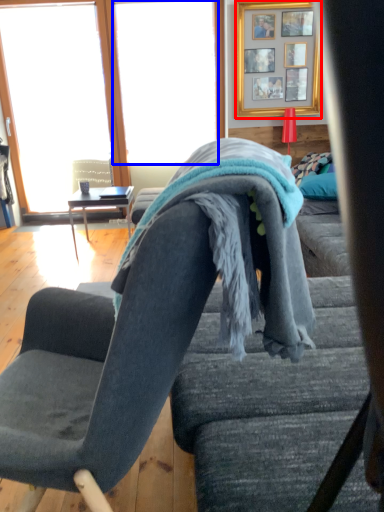
Question: Which point is further to the camera, picture frame (highlighted by a red box) or window screen (highlighted by a blue box)?

Choices:
 (A) picture frame
 (B) window screen

Answer: (B)